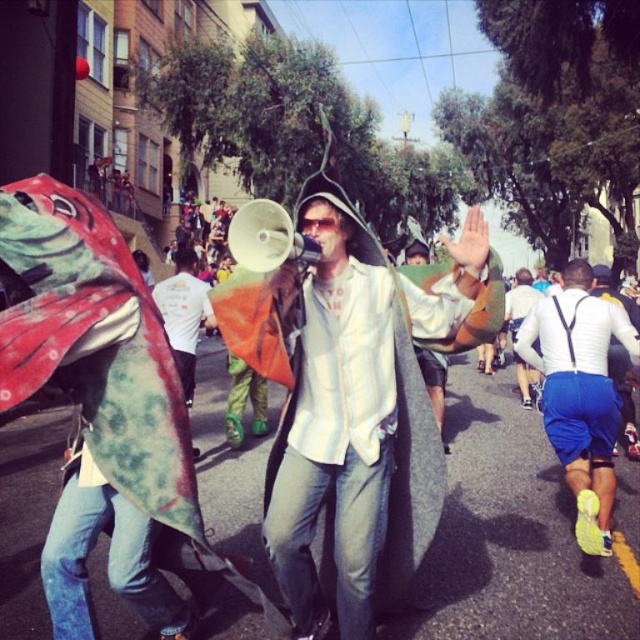
Is white striped shirt at center above white matte shorts at lower right?

Indeed, white striped shirt at center is positioned over white matte shorts at lower right.

Does white striped shirt at center come behind white matte shorts at lower right?

That is False.

Where is `white striped shirt at center`? Image resolution: width=640 pixels, height=640 pixels. white striped shirt at center is located at coordinates (358, 417).

At what (x,y) coordinates should I click in order to perform the action: click on white striped shirt at center. Please return your answer as a coordinate pair (x, y). The height and width of the screenshot is (640, 640). Looking at the image, I should click on (358, 417).